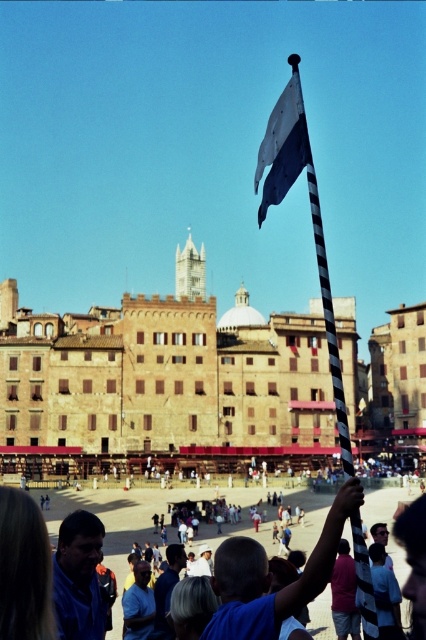
You are standing in the historic European square and want to take a photo of the brown stone building at center. Where should you position yourself to capture the building in the center of your camera frame?

To capture the brown stone building at center in the center of your camera frame, position yourself directly in front of it, aligning the building with the center point of your viewfinder. Since the building is located at coordinates approximately 0.598 on the x and 0.383 on the y axis, centering your frame on these coordinates will ensure the building is centered.

You are an architect analyzing the proportions of the buildings in the square. Given that the white fabric flag at upper center is 2 meters wide, can you estimate the minimum width of the brown stone building at center?

The brown stone building at center is wider than the white fabric flag at upper center. Since the flag is 2 meters wide, the building must be wider than 2 meters.

You are an architect visiting the square and want to take a photo of the brown stone building at center and the white fabric flag at upper center. Which object should you focus on first if you want to capture both in a single frame without moving the camera?

The brown stone building at center is bigger than the white fabric flag at upper center, so you should focus on the brown stone building at center first to ensure it fills the frame appropriately while still capturing the smaller flag in the background.